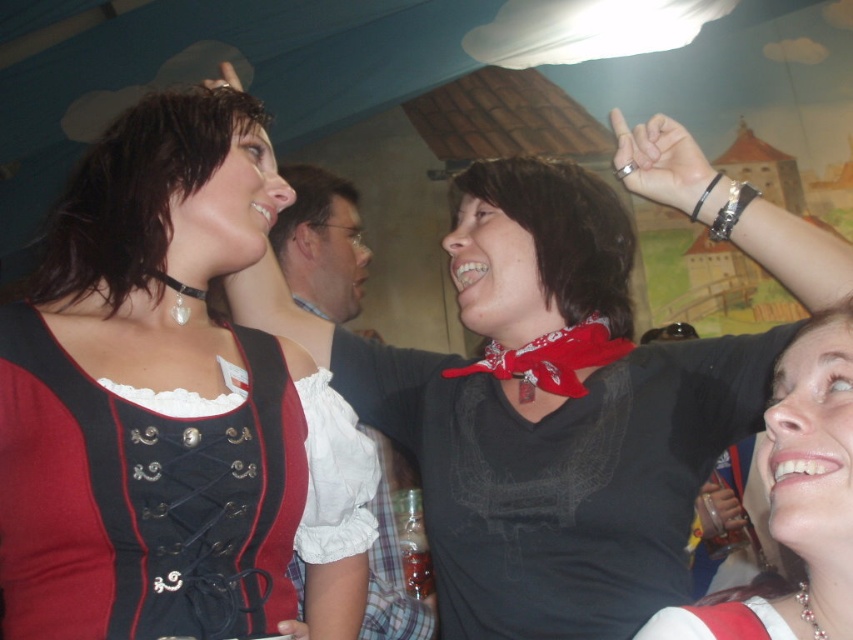
Question: Which object is positioned farthest from the matte black dirndl at left?

Choices:
 (A) matte black ring at upper center
 (B) silver metallic ring at upper right

Answer: (B)

Question: Which of the following is the farthest from the observer?

Choices:
 (A) (71, 332)
 (B) (59, 227)
 (C) (570, 323)

Answer: (C)

Question: Which point is closer to the camera taking this photo?

Choices:
 (A) (618, 116)
 (B) (828, 403)
 (C) (592, 240)

Answer: (B)

Question: Is matte black dirndl at left above matte black ring at upper center?

Choices:
 (A) no
 (B) yes

Answer: (A)

Question: From the image, what is the correct spatial relationship of matte black shirt at center in relation to silver metallic ring at upper right?

Choices:
 (A) left
 (B) right

Answer: (A)

Question: Is black leather choker at upper left below matte black vest at center?

Choices:
 (A) no
 (B) yes

Answer: (B)